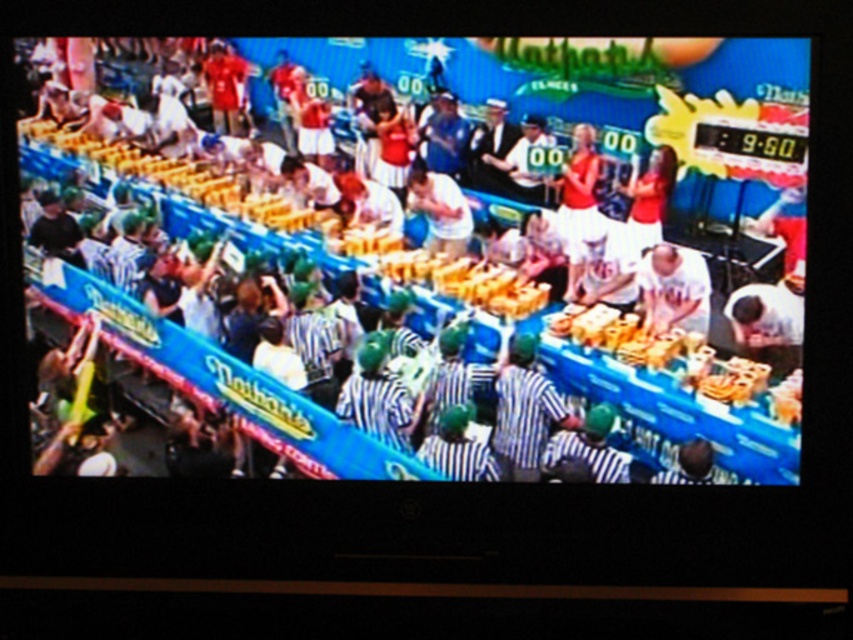
Question: Among these points, which one is nearest to the camera?

Choices:
 (A) (70, 380)
 (B) (467, 228)

Answer: (B)

Question: Considering the relative positions of white striped shirt at center and white matte shirt at center in the image provided, where is white striped shirt at center located with respect to white matte shirt at center?

Choices:
 (A) right
 (B) left

Answer: (B)

Question: Is white striped shirt at center wider than white matte shirt at center?

Choices:
 (A) yes
 (B) no

Answer: (A)

Question: Can you confirm if white striped shirt at center is wider than white matte shirt at center?

Choices:
 (A) yes
 (B) no

Answer: (A)